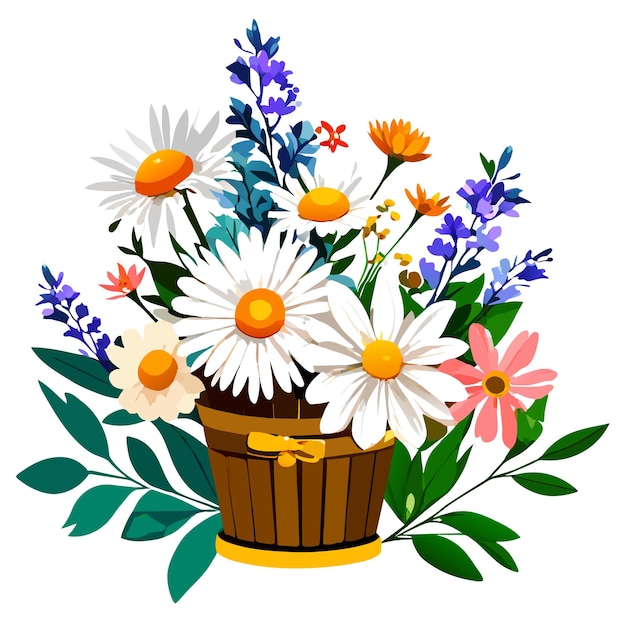
Where is `vertical slats on basket`? The width and height of the screenshot is (626, 626). vertical slats on basket is located at coordinates (220, 479), (235, 481), (260, 493), (283, 495), (310, 500), (337, 493), (360, 489), (377, 481).